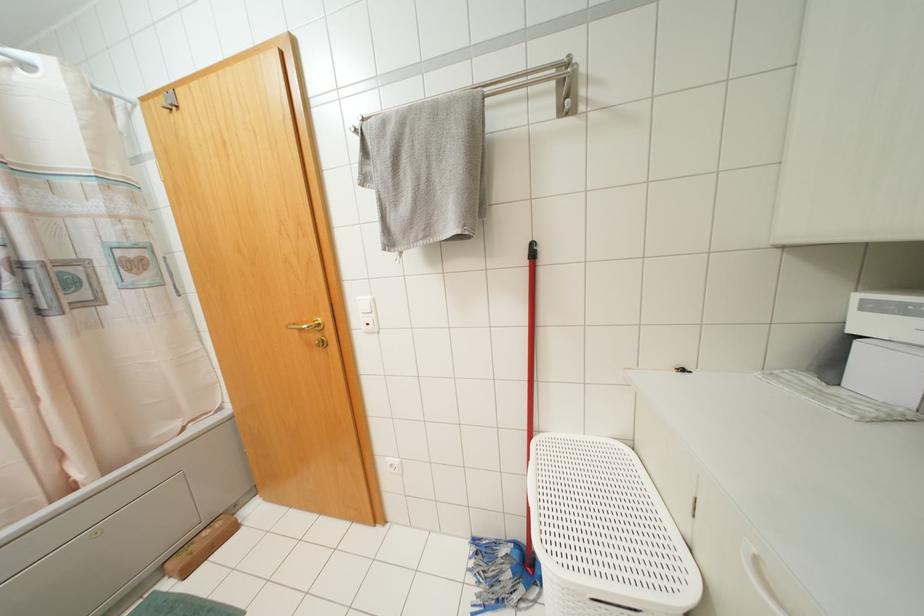
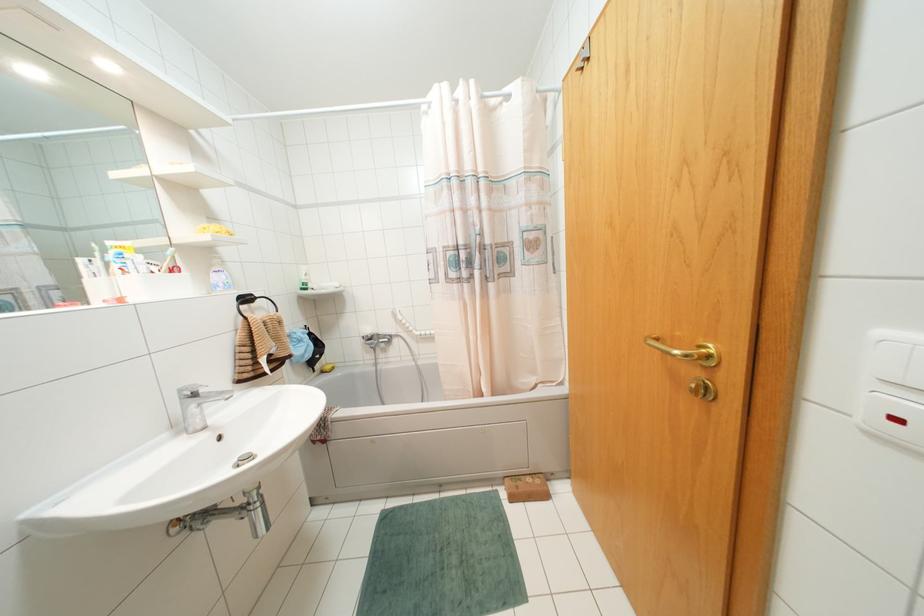
Question: How did the camera likely rotate?

Choices:
 (A) Left
 (B) Right
 (C) Up
 (D) Down

Answer: (A)